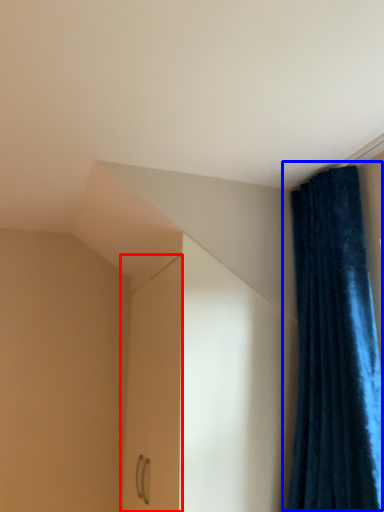
Question: Which of the following is the closest to the observer, screen door (highlighted by a red box) or curtain (highlighted by a blue box)?

Choices:
 (A) screen door
 (B) curtain

Answer: (B)